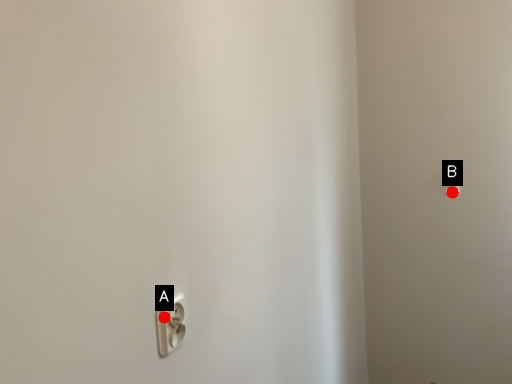
Question: Two points are circled on the image, labeled by A and B beside each circle. Which point is further to the camera?

Choices:
 (A) A is further
 (B) B is further

Answer: (B)